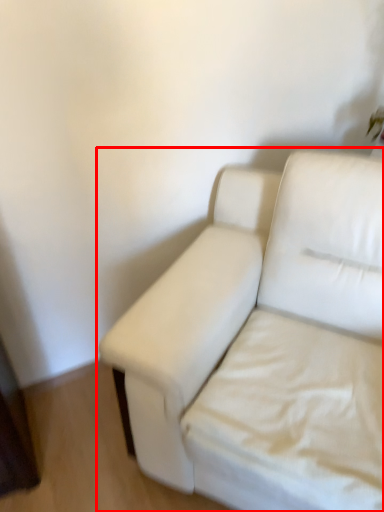
Question: From the image's perspective, what is the correct spatial relationship of studio couch (annotated by the red box) in relation to sheet?

Choices:
 (A) below
 (B) above

Answer: (B)